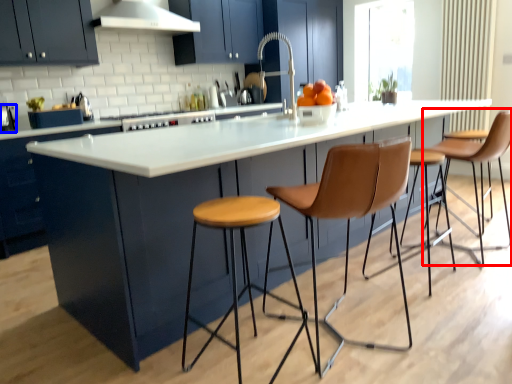
Question: Which object appears closest to the camera in this image, chair (highlighted by a red box) or appliance (highlighted by a blue box)?

Choices:
 (A) chair
 (B) appliance

Answer: (A)